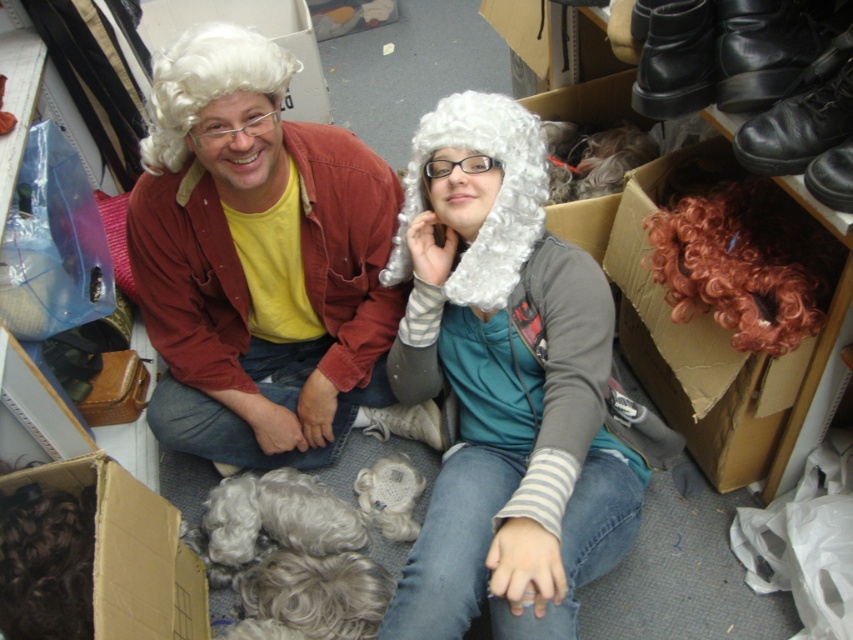
Can you confirm if white fluffy wig at center is positioned to the right of matte white wig at center?

Yes, white fluffy wig at center is to the right of matte white wig at center.

Does white fluffy wig at center come behind matte white wig at center?

No, it is in front of matte white wig at center.

Is point (402, 618) closer to camera compared to point (207, 26)?

That is True.

Find the location of `white fluffy wig at center`. white fluffy wig at center is located at coordinates (503, 385).

Can you confirm if matte white wig at center is smaller than white curly wig at center?

No, matte white wig at center is not smaller than white curly wig at center.

Is matte white wig at center thinner than white curly wig at center?

In fact, matte white wig at center might be wider than white curly wig at center.

Is point (236, 305) behind point (498, 141)?

Yes.

Find the location of a particular element. matte white wig at center is located at coordinates (257, 259).

Does white curly wig at center lie behind white curly wig at upper left?

Yes, white curly wig at center is behind white curly wig at upper left.

Can you confirm if white curly wig at center is shorter than white curly wig at upper left?

Incorrect, white curly wig at center's height does not fall short of white curly wig at upper left's.

This screenshot has width=853, height=640. What do you see at coordinates (492, 200) in the screenshot? I see `white curly wig at center` at bounding box center [492, 200].

The image size is (853, 640). I want to click on white curly wig at center, so click(492, 200).